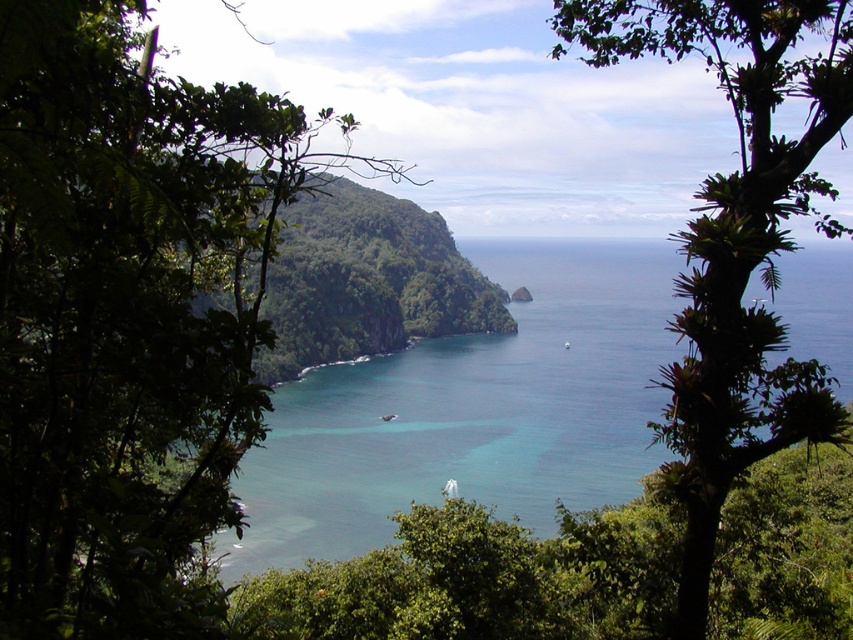
Question: Which point is farther to the camera?

Choices:
 (A) (48, 312)
 (B) (381, 384)
 (C) (723, 225)

Answer: (B)

Question: Does green leafy tree at center appear on the right side of green leafy tree at right?

Choices:
 (A) yes
 (B) no

Answer: (B)

Question: Can you confirm if green leafy tree at center is thinner than green leafy tree at right?

Choices:
 (A) no
 (B) yes

Answer: (B)

Question: Which object is the farthest from the green leafy tree at center?

Choices:
 (A) green leafy tree at right
 (B) clear blue water at center

Answer: (B)

Question: Is the position of green leafy tree at center more distant than that of green leafy tree at right?

Choices:
 (A) yes
 (B) no

Answer: (B)

Question: Which object appears closest to the camera in this image?

Choices:
 (A) green leafy tree at center
 (B) clear blue water at center
 (C) green leafy tree at right

Answer: (A)